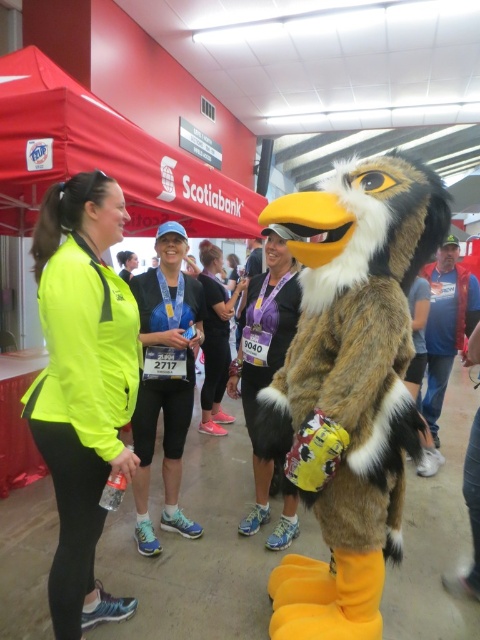
Question: Where is neon yellow jacket at left located in relation to neon yellow jacket at center in the image?

Choices:
 (A) below
 (B) above

Answer: (A)

Question: Does neon yellow jacket at center have a lesser width compared to black fabric leggings at center?

Choices:
 (A) yes
 (B) no

Answer: (A)

Question: Is white fur jacket at center thinner than black fabric leggings at center?

Choices:
 (A) yes
 (B) no

Answer: (A)

Question: Which of the following is the farthest from the observer?

Choices:
 (A) white fur jacket at center
 (B) neon yellow jacket at left
 (C) black fabric leggings at center

Answer: (C)

Question: Estimate the real-world distances between objects in this image. Which object is closer to the white fur jacket at center?

Choices:
 (A) black fabric leggings at center
 (B) neon yellow jacket at left

Answer: (B)

Question: Which of the following is the closest to the observer?

Choices:
 (A) (73, 621)
 (B) (273, 284)
 (C) (173, 285)
 (D) (216, 396)

Answer: (A)